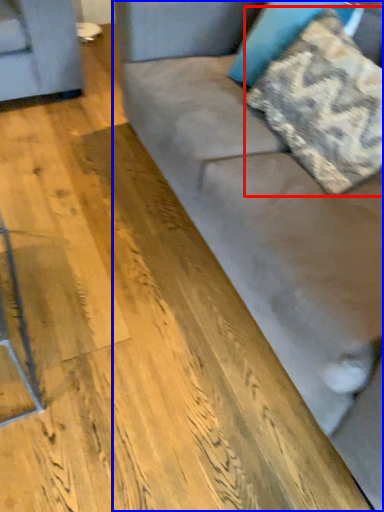
Question: Among these objects, which one is nearest to the camera, pillow (highlighted by a red box) or studio couch (highlighted by a blue box)?

Choices:
 (A) pillow
 (B) studio couch

Answer: (B)